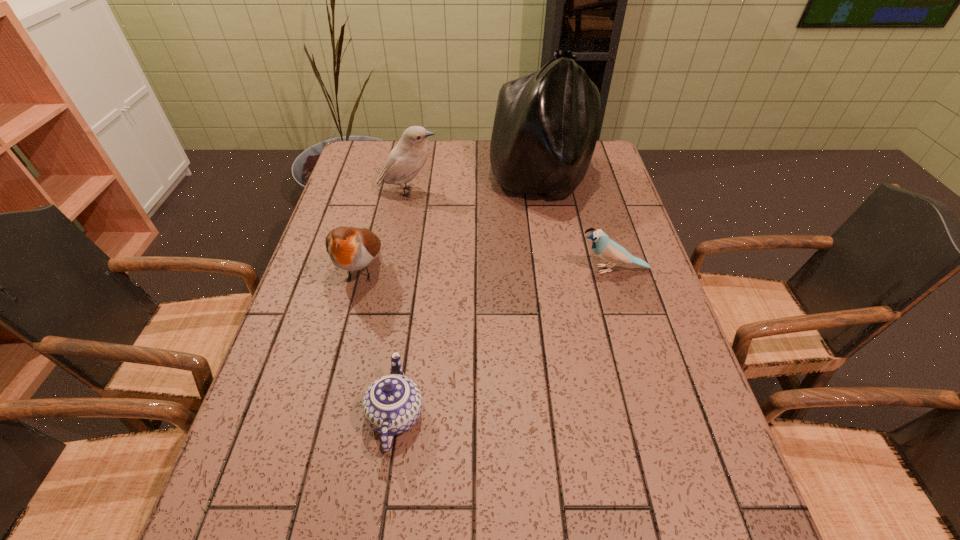
The height and width of the screenshot is (540, 960). I want to click on vacant area at the far edge of the desktop, so click(423, 170).

In the image, there is a desktop. At what (x,y) coordinates should I click in order to perform the action: click on vacant space at the left edge. Please return your answer as a coordinate pair (x, y). The image size is (960, 540). Looking at the image, I should click on (374, 177).

This screenshot has width=960, height=540. I want to click on free region at the right edge of the desktop, so click(x=660, y=367).

Locate an element on the screen. free space at the near left corner is located at coordinates (223, 537).

In the image, there is a desktop. Where is `free space at the far right corner`? The image size is (960, 540). free space at the far right corner is located at coordinates (608, 165).

What are the coordinates of `free space between the rightmost bird and the tallest object` in the screenshot? It's located at (x=577, y=225).

The image size is (960, 540). In order to click on free space between the farthest bird and the third shortest object in this screenshot , I will do `click(385, 231)`.

Where is `free space between the third tallest object and the chinaware`? free space between the third tallest object and the chinaware is located at coordinates (378, 342).

Locate an element on the screen. The width and height of the screenshot is (960, 540). free space between the farthest bird and the nearest object is located at coordinates (402, 303).

Find the location of a particular element. The image size is (960, 540). empty space that is in between the farthest bird and the chinaware is located at coordinates (402, 303).